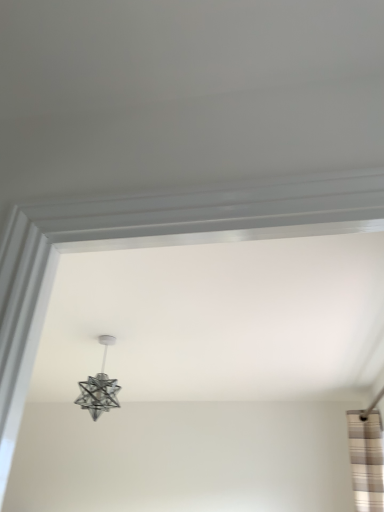
At what (x,y) coordinates should I click in order to perform the action: click on striped fabric curtain at right. Please return your answer as a coordinate pair (x, y). The width and height of the screenshot is (384, 512). Looking at the image, I should click on tap(366, 460).

What do you see at coordinates (366, 460) in the screenshot? I see `striped fabric curtain at right` at bounding box center [366, 460].

I want to click on striped fabric curtain at right, so click(x=366, y=460).